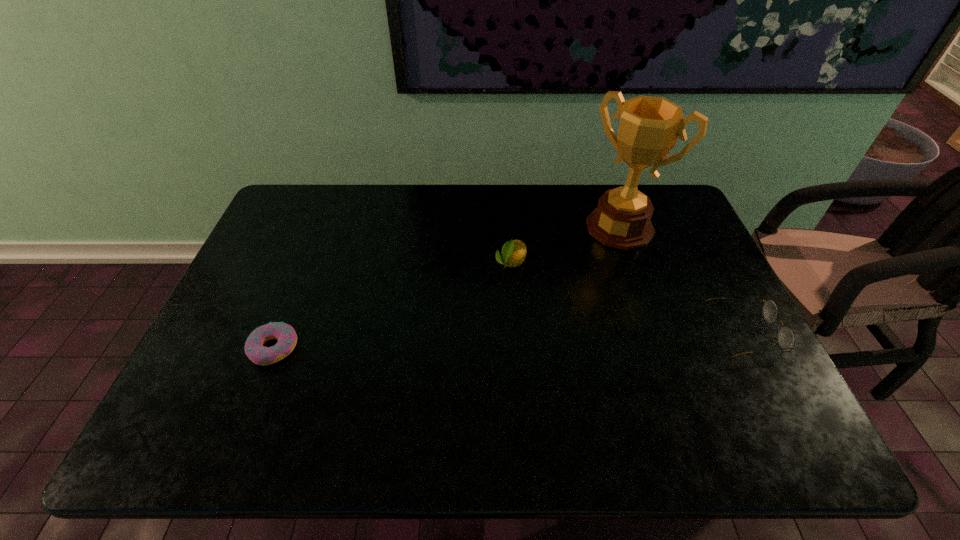
You are a GUI agent. You are given a task and a screenshot of the screen. Output one action in this format:
    pyautogui.click(x=<x>, y=<y>)
    Task: Click on the vacant position at the far edge of the desktop
    The height and width of the screenshot is (540, 960).
    Given the screenshot: What is the action you would take?
    pyautogui.click(x=362, y=215)

You are a GUI agent. You are given a task and a screenshot of the screen. Output one action in this format:
    pyautogui.click(x=<x>, y=<y>)
    Task: Click on the vacant space at the near edge
    Image resolution: width=960 pixels, height=540 pixels.
    Given the screenshot: What is the action you would take?
    pyautogui.click(x=328, y=396)

Image resolution: width=960 pixels, height=540 pixels. In the image, there is a desktop. In order to click on vacant space at the left edge in this screenshot , I will do `click(268, 238)`.

In the image, there is a desktop. Identify the location of free space at the near right corner. Image resolution: width=960 pixels, height=540 pixels. (736, 402).

You are a GUI agent. You are given a task and a screenshot of the screen. Output one action in this format:
    pyautogui.click(x=<x>, y=<y>)
    Task: Click on the free spot between the third tallest object and the third object from right to left
    The height and width of the screenshot is (540, 960).
    Given the screenshot: What is the action you would take?
    pyautogui.click(x=628, y=298)

Identify the location of free space between the doughnut and the lemon. (392, 306).

Find the location of a particular element. The height and width of the screenshot is (540, 960). free space between the tallest object and the third object from right to left is located at coordinates (565, 246).

The image size is (960, 540). What are the coordinates of `vacant space that's between the lemon and the award` in the screenshot? It's located at (565, 246).

Locate an element on the screen. vacant space that's between the rightmost object and the second farthest object is located at coordinates (628, 298).

Image resolution: width=960 pixels, height=540 pixels. I want to click on empty space between the leftmost object and the third tallest object, so click(x=509, y=341).